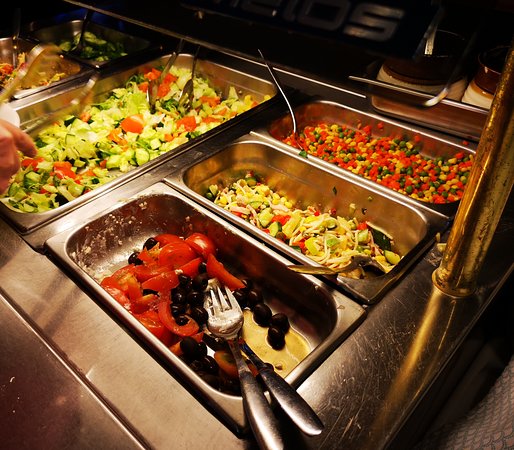
Identify the location of floor. (489, 426).